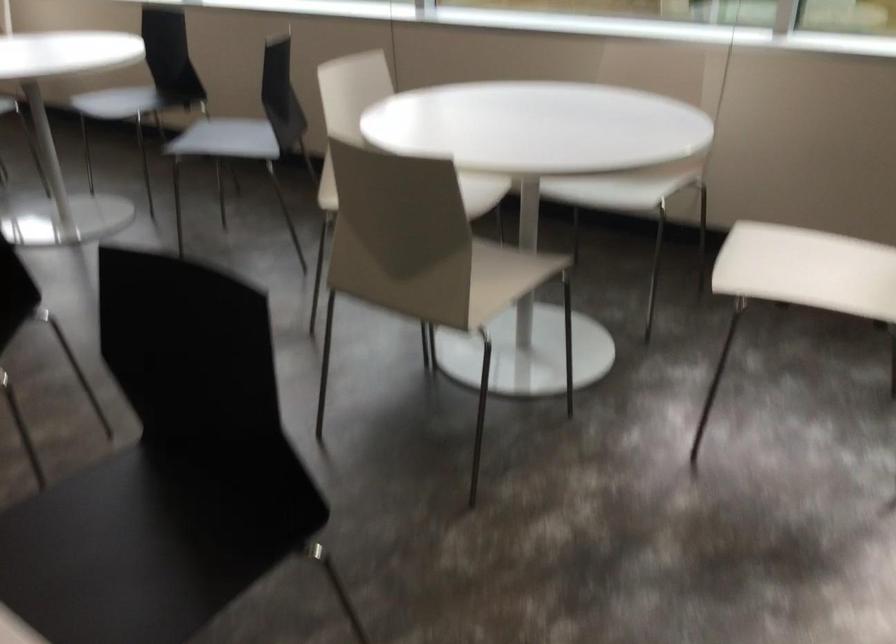
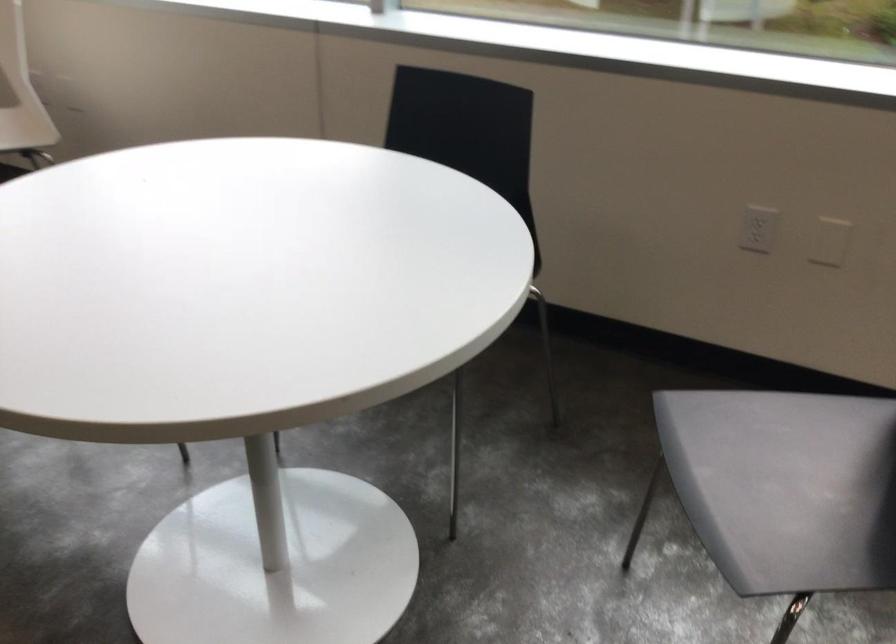
The images are taken continuously from a first-person perspective. In which direction are you moving?

Result: The cameraman moved toward left, forward.